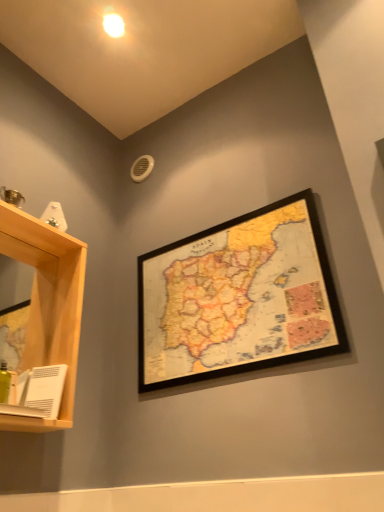
Question: Is white matte book at lower left at the left side of light wood shelf at left?

Choices:
 (A) no
 (B) yes

Answer: (A)

Question: From the image's perspective, is white matte book at lower left on top of light wood shelf at left?

Choices:
 (A) no
 (B) yes

Answer: (A)

Question: Considering the relative sizes of white matte book at lower left and light wood shelf at left in the image provided, is white matte book at lower left bigger than light wood shelf at left?

Choices:
 (A) no
 (B) yes

Answer: (A)

Question: Does white matte book at lower left come in front of light wood shelf at left?

Choices:
 (A) no
 (B) yes

Answer: (A)

Question: Considering the relative sizes of white matte book at lower left and light wood shelf at left in the image provided, is white matte book at lower left wider than light wood shelf at left?

Choices:
 (A) no
 (B) yes

Answer: (A)

Question: Is wooden framed map at upper center situated inside white matte book at lower left or outside?

Choices:
 (A) inside
 (B) outside

Answer: (B)

Question: Is wooden framed map at upper center in front of or behind white matte book at lower left in the image?

Choices:
 (A) behind
 (B) front

Answer: (B)

Question: From the image's perspective, relative to white matte book at lower left, is wooden framed map at upper center above or below?

Choices:
 (A) below
 (B) above

Answer: (B)

Question: Considering the relative positions of wooden framed map at upper center and white matte book at lower left in the image provided, is wooden framed map at upper center to the left or to the right of white matte book at lower left?

Choices:
 (A) left
 (B) right

Answer: (B)

Question: Is point (6, 414) closer or farther from the camera than point (236, 331)?

Choices:
 (A) closer
 (B) farther

Answer: (A)

Question: From the image's perspective, is white matte book at lower left located above or below wooden framed map at upper center?

Choices:
 (A) above
 (B) below

Answer: (B)

Question: Looking at the image, does white matte book at lower left seem bigger or smaller compared to wooden framed map at upper center?

Choices:
 (A) big
 (B) small

Answer: (B)

Question: Would you say white matte book at lower left is to the left or to the right of wooden framed map at upper center in the picture?

Choices:
 (A) right
 (B) left

Answer: (B)

Question: Is white matte book at lower left in front of or behind light wood shelf at left in the image?

Choices:
 (A) front
 (B) behind

Answer: (B)

Question: Is white matte book at lower left spatially inside light wood shelf at left, or outside of it?

Choices:
 (A) inside
 (B) outside

Answer: (A)